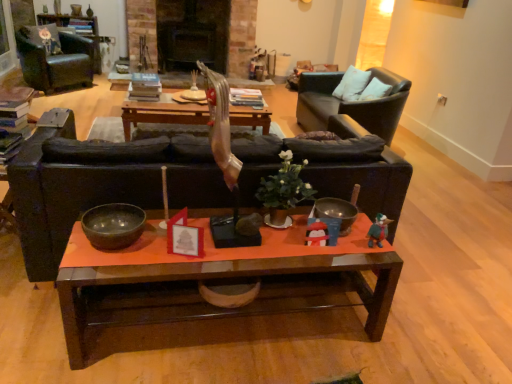
Find the location of a particular element. The height and width of the screenshot is (384, 512). vacant space to the right of shiny brown wooden coffee table at center, which is counted as the second coffee table, starting from the top is located at coordinates (424, 318).